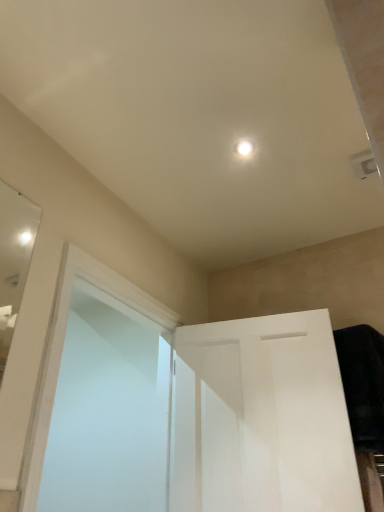
Question: Is frosted glass screen door at left taller or shorter than white matte door at center?

Choices:
 (A) short
 (B) tall

Answer: (B)

Question: From a real-world perspective, is frosted glass screen door at left positioned above or below white matte door at center?

Choices:
 (A) below
 (B) above

Answer: (B)

Question: In terms of width, does frosted glass screen door at left look wider or thinner when compared to white matte door at center?

Choices:
 (A) thin
 (B) wide

Answer: (B)

Question: Is white matte door at center in front of or behind frosted glass screen door at left in the image?

Choices:
 (A) front
 (B) behind

Answer: (B)

Question: From the image's perspective, is white matte door at center positioned above or below frosted glass screen door at left?

Choices:
 (A) above
 (B) below

Answer: (B)

Question: Would you say white matte door at center is to the left or to the right of frosted glass screen door at left in the picture?

Choices:
 (A) right
 (B) left

Answer: (A)

Question: Is white matte door at center wider or thinner than frosted glass screen door at left?

Choices:
 (A) thin
 (B) wide

Answer: (A)